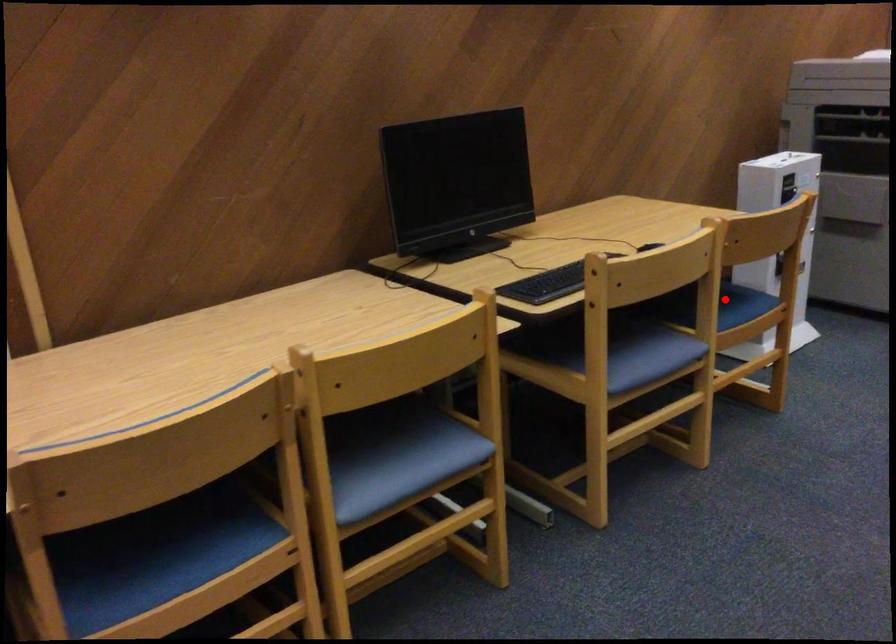
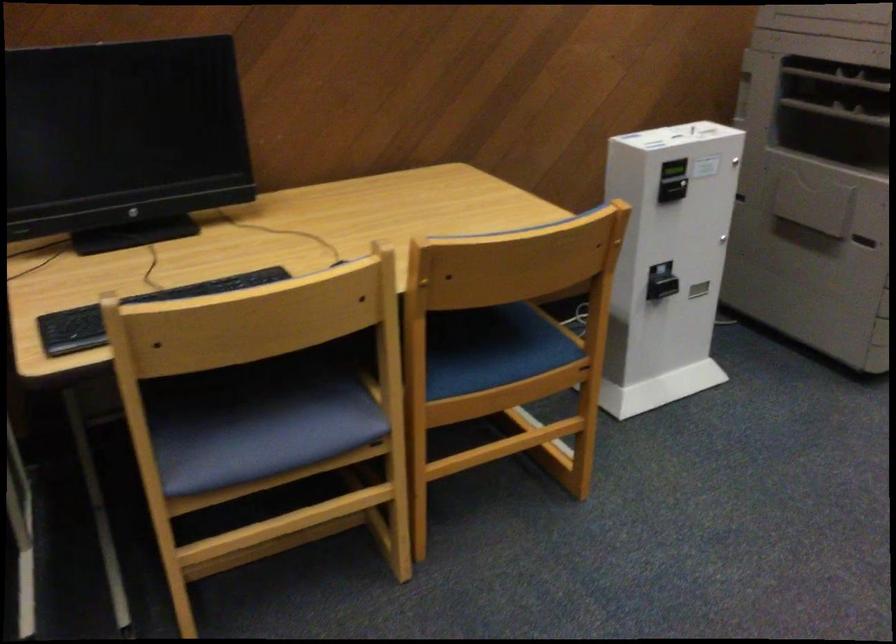
Find the pixel in the second image that matches the highlighted location in the first image.

(492, 348)